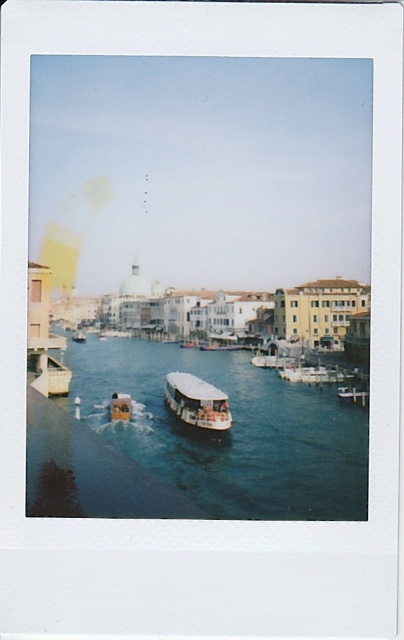
Is blue waterway at center to the left of white matte boat at center from the viewer's perspective?

Yes, blue waterway at center is to the left of white matte boat at center.

Can you confirm if blue waterway at center is bigger than white matte boat at center?

Yes, blue waterway at center is bigger than white matte boat at center.

Measure the distance between point (140, 436) and camera.

Point (140, 436) is 97.17 meters from camera.

Find the location of `blue waterway at center`. blue waterway at center is located at coordinates (229, 432).